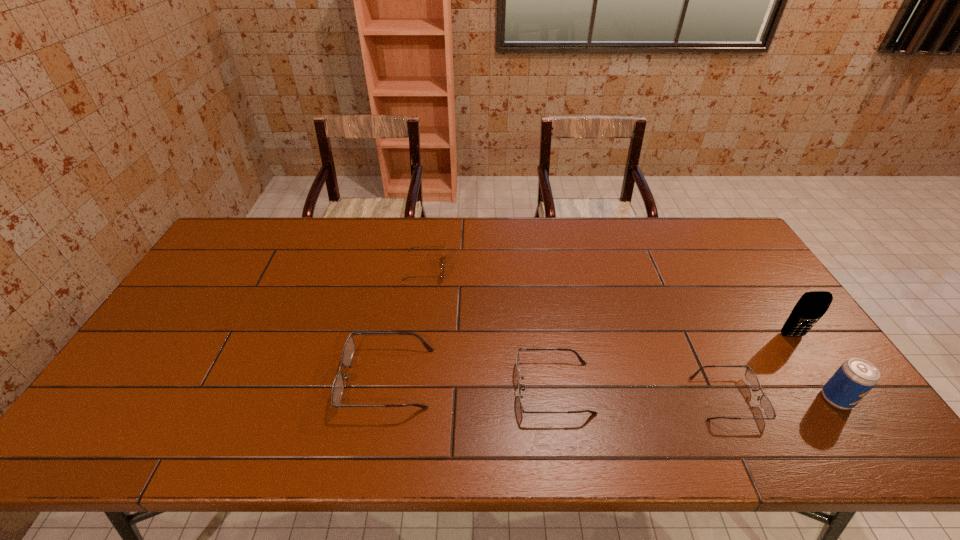
Identify the location of free point that satisfies the following two spatial constraints: 1. on the screen of the fifth shortest object; 2. on the left side of the fifth nearest object. (835, 399).

I want to click on free space that satisfies the following two spatial constraints: 1. on the screen of the tallest object; 2. on the front-facing side of the tallest spectacles, so click(x=821, y=379).

Locate an element on the screen. This screenshot has width=960, height=540. vacant point that satisfies the following two spatial constraints: 1. on the back side of the beer can; 2. on the front-facing side of the third object from left to right is located at coordinates (829, 388).